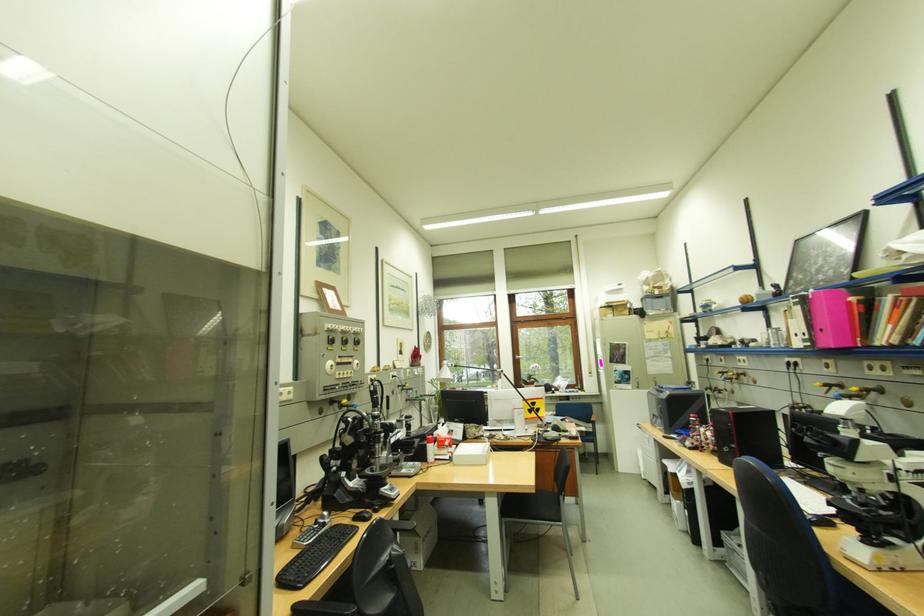
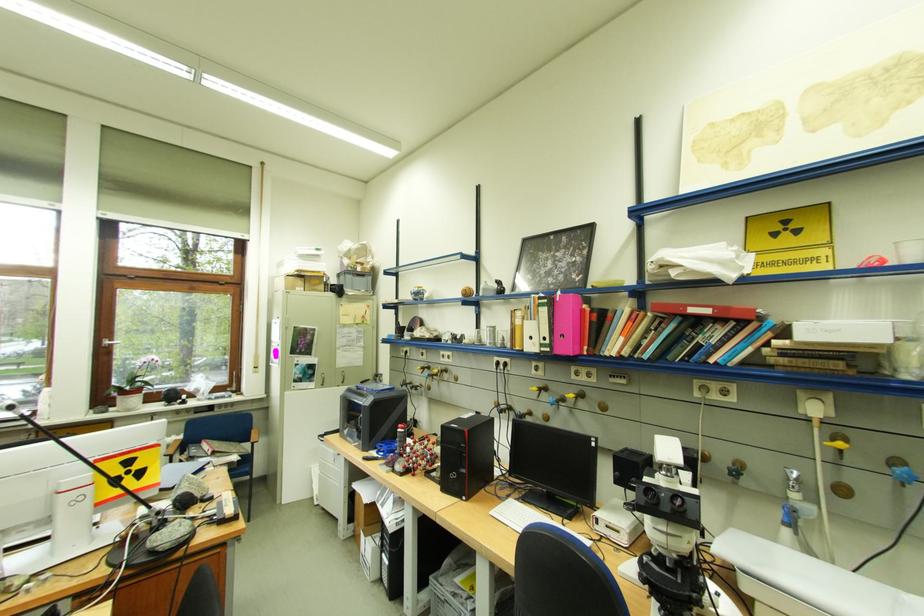
In the second image, find the point that corresponds to point 528,358 in the first image.

(117, 342)